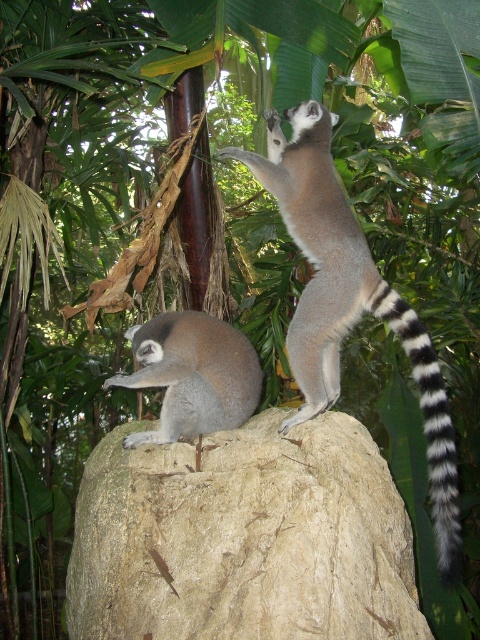
You are a wildlife photographer aiming to capture a closeup shot of the lemurs. You are currently positioned at the camera location. The point of interest for your shot is at point (331, 433). Given that the distance from the camera to this point is 7.68 feet, can you determine if you need to adjust your camera focus to capture the lemurs clearly?

The distance from the camera to the point of interest is 7.68 feet. Since the lemurs are positioned on the large light colored rock at that point, you should adjust your camera focus to 7.68 feet to capture them clearly.

From the picture: You are a wildlife photographer aiming to capture both the soft gray fur lemur at center and the black and white striped tail at upper right in a single frame. Based on their sizes, which animal would appear larger in your photo?

The black and white striped tail at upper right would appear larger in the photo because it is larger than the soft gray fur lemur at center.